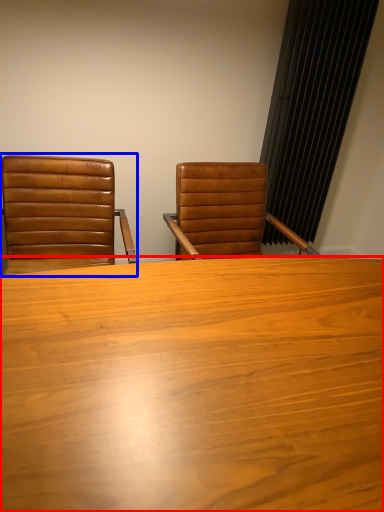
Question: Which object appears farthest to the camera in this image, table (highlighted by a red box) or chair (highlighted by a blue box)?

Choices:
 (A) table
 (B) chair

Answer: (B)